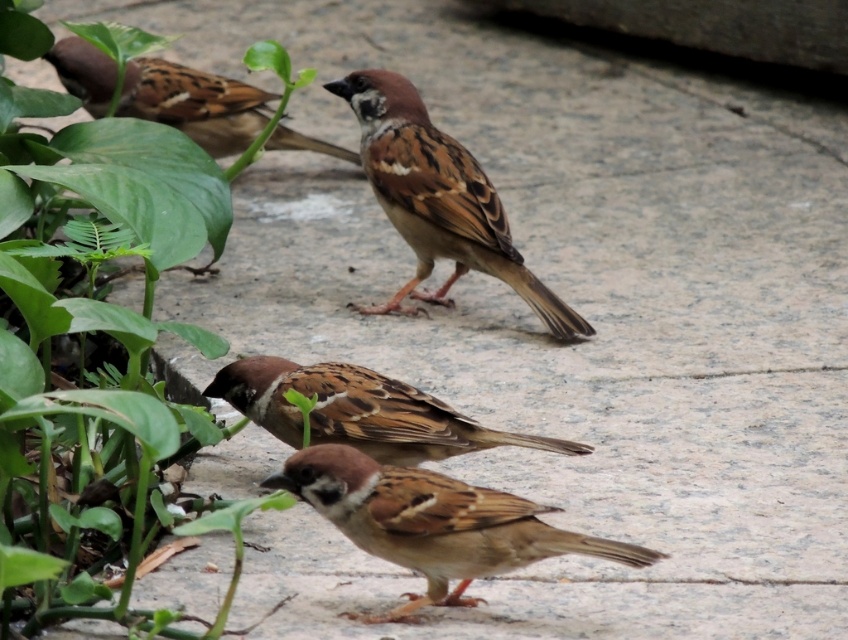
Find the location of `brown speckled feathers at center`. brown speckled feathers at center is located at coordinates (433, 522).

Which is in front, point (508, 564) or point (276, 362)?

Point (508, 564) is in front.

The image size is (848, 640). What are the coordinates of `brown speckled feathers at center` in the screenshot? It's located at (433, 522).

Is the position of brown speckled feathers at center less distant than that of brown speckled sparrow at upper center?

Yes, brown speckled feathers at center is closer to the viewer.

Which is more to the right, brown speckled feathers at center or brown speckled sparrow at upper center?

brown speckled feathers at center

Is point (325, 508) closer to viewer compared to point (127, 97)?

Yes, it is in front of point (127, 97).

Locate an element on the screen. The height and width of the screenshot is (640, 848). brown speckled feathers at center is located at coordinates (433, 522).

Can you confirm if brown feathered sparrow at center is thinner than brown speckled sparrow at upper center?

Yes.

Is brown feathered sparrow at center shorter than brown speckled sparrow at upper center?

Yes, brown feathered sparrow at center is shorter than brown speckled sparrow at upper center.

Who is more distant from viewer, (388, 404) or (166, 115)?

Positioned behind is point (166, 115).

Locate an element on the screen. This screenshot has height=640, width=848. brown feathered sparrow at center is located at coordinates (361, 412).